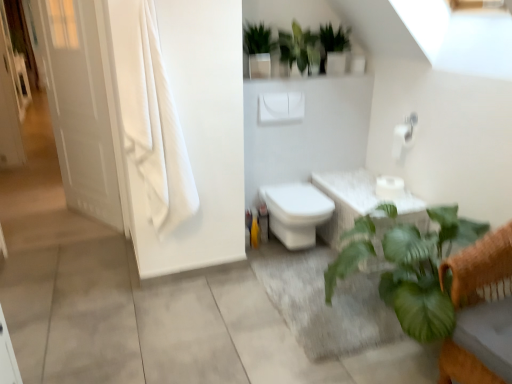
Locate an element on the screen. vacant area that is in front of white glossy door at left is located at coordinates (78, 232).